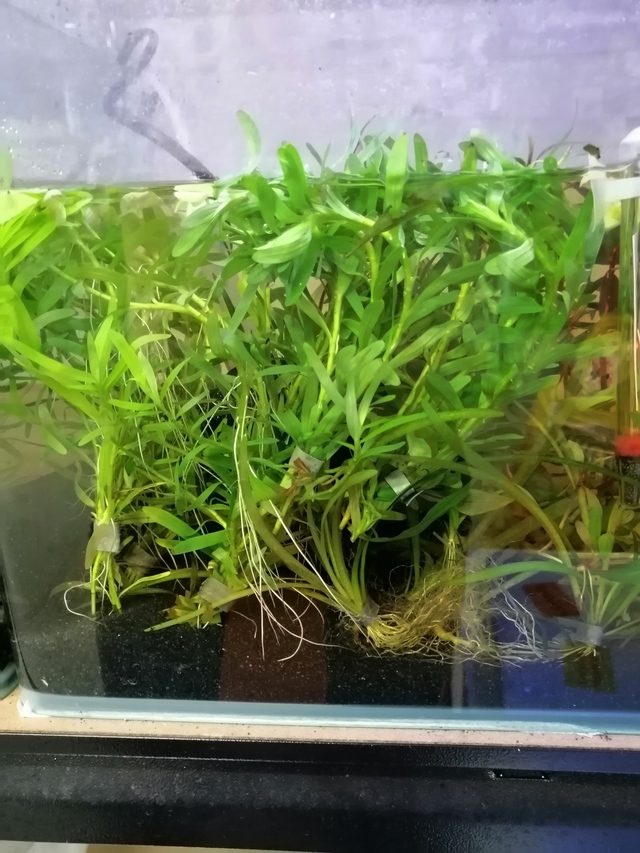
Image resolution: width=640 pixels, height=853 pixels. Identify the location of tan floor or table. (54, 846).